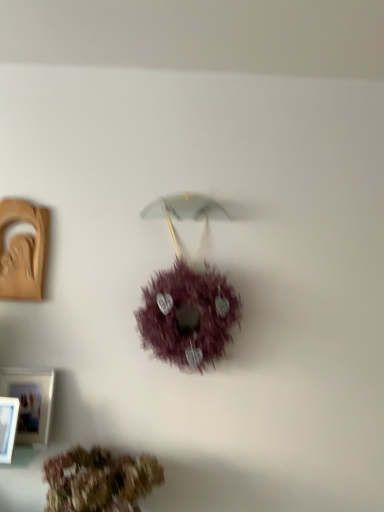
Question: Is white plastic picture frame at lower left, which is the third picture frame from back to front, to the left or to the right of white matte picture frame at lower left, the second picture frame in the back-to-front sequence, in the image?

Choices:
 (A) right
 (B) left

Answer: (B)

Question: Relative to white matte picture frame at lower left, arranged as the 2th picture frame when ordered from the bottom, is white plastic picture frame at lower left, which ranks as the 1th picture frame in front-to-back order, in front or behind?

Choices:
 (A) behind
 (B) front

Answer: (B)

Question: Based on their relative distances, which object is nearer to the purple fluffy wreath at center, the second flower ordered from the bottom?

Choices:
 (A) white matte picture frame at lower left, acting as the 2th picture frame starting from the front
 (B) brown textured wreath at lower center, marked as the second flower in a top-to-bottom arrangement
 (C) white plastic picture frame at lower left, which ranks as the 1th picture frame in front-to-back order
 (D) matte brown picture frame at left, the 3th picture frame when ordered from front to back

Answer: (B)

Question: Which is nearer to the brown textured wreath at lower center, which ranks as the first flower in bottom-to-top order?

Choices:
 (A) matte brown picture frame at left, the 1th picture frame positioned from the top
 (B) white matte picture frame at lower left, arranged as the 2th picture frame when ordered from the bottom
 (C) purple fluffy wreath at center, which is counted as the 1th flower, starting from the top
 (D) white plastic picture frame at lower left, marked as the 3th picture frame in a top-to-bottom arrangement

Answer: (B)